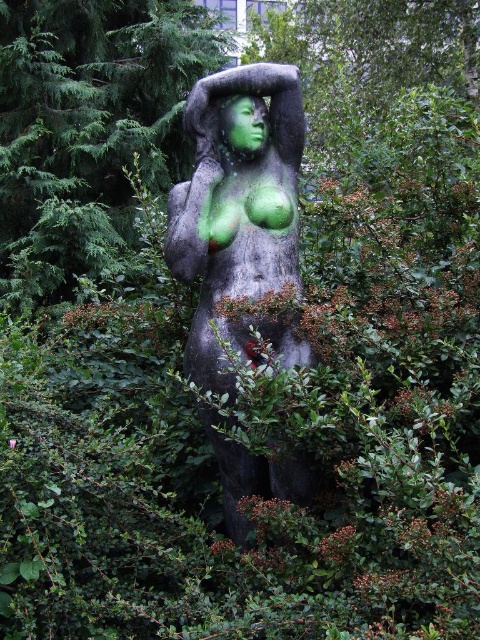
Looking at this image, you are an art student analyzing the statue arrangement in the image. You notice two statues labeled as the green matte statue at center and the green stone statue at center. Which one appears closer to you?

The green matte statue at center appears closer to you than the green stone statue at center.

You are an art conservator assessing the statue. You need to determine if the green stone statue at center can be safely moved using a crane that can handle objects up to 3 meters tall. The green matte face at center is only 0.5 meters tall. Can the crane accommodate the statue?

The green stone statue at center is much taller than the green matte face at center, which is only 0.5 meters tall. Since the statue is significantly taller, it likely exceeds the crane capacity of 3 meters. Therefore, the crane cannot accommodate the statue.